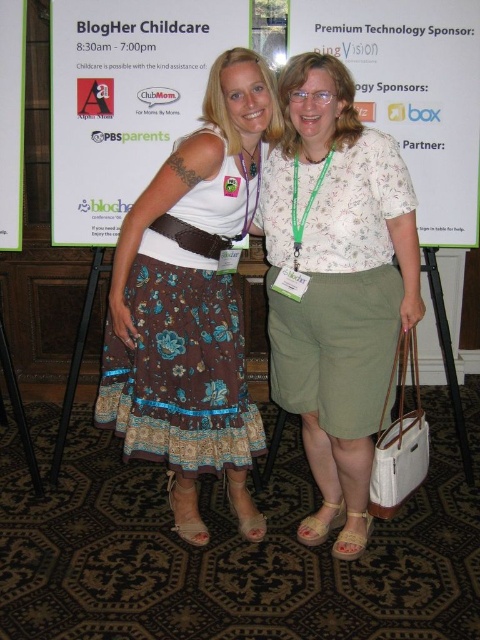
You are standing 10 feet away from the BlogHer Childcare backdrop. There is a point at coordinates point (x=141, y=336). Can you reach that point without moving closer than 6 feet to it?

The distance of point (x=141, y=336) from viewer is 6.71 feet. Since you are currently 10 feet away, you can move closer to 6.71 feet, which is within the 6 feet limit. Therefore, you can reach the point without moving closer than 6 feet to it.

You are an event planner trying to determine if the white paper poster at upper center can be placed above the light brown leather sandal at lower center without blocking the sandal. Based on their sizes, is this possible?

The white paper poster at upper center has a greater height compared to the light brown leather sandal at lower center, so placing the poster above the sandal would not block it since the poster is taller and can be positioned higher up without obstruction.